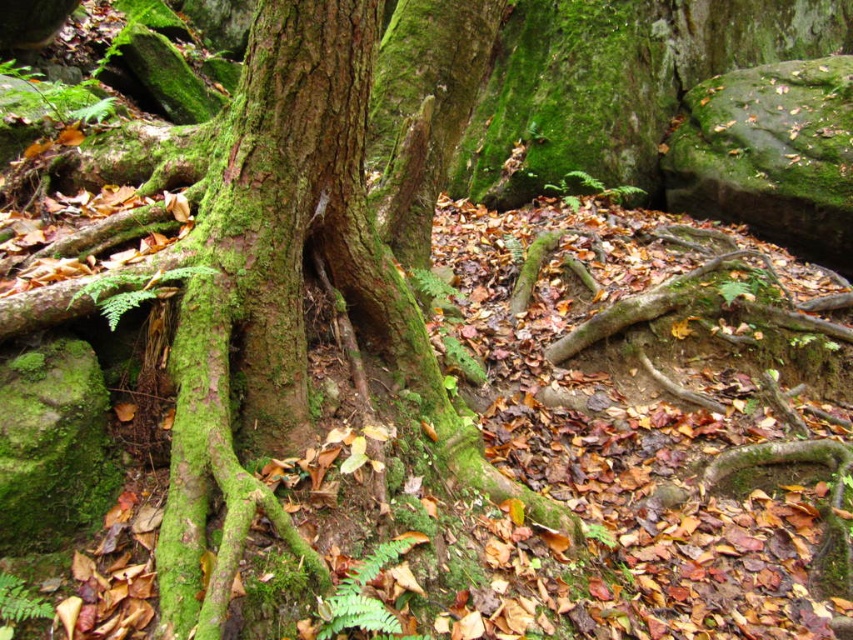
The width and height of the screenshot is (853, 640). Identify the location of green mossy tree roots at center. coord(262,346).

Between green mossy tree roots at center and green mossy tree trunk at center, which one has more height?

green mossy tree roots at center is taller.

Which is in front, point (466, 552) or point (222, 192)?

Point (222, 192) is in front.

This screenshot has width=853, height=640. I want to click on green mossy tree roots at center, so click(262, 346).

The width and height of the screenshot is (853, 640). What do you see at coordinates (262, 346) in the screenshot? I see `green mossy tree roots at center` at bounding box center [262, 346].

Is green mossy tree roots at center smaller than green matte fern at center?

No, green mossy tree roots at center is not smaller than green matte fern at center.

Who is more distant from viewer, (277,365) or (337,589)?

The point (277,365) is behind.

Find the location of a particular element. The image size is (853, 640). green mossy tree roots at center is located at coordinates (262, 346).

Can you confirm if green mossy tree trunk at center is positioned below green matte fern at center?

No.

Can you confirm if green mossy tree trunk at center is shorter than green matte fern at center?

No, green mossy tree trunk at center is not shorter than green matte fern at center.

Is point (245, 275) farther from camera compared to point (337, 621)?

Yes, it is behind point (337, 621).

This screenshot has width=853, height=640. Find the location of `green mossy tree trunk at center`. green mossy tree trunk at center is located at coordinates (257, 291).